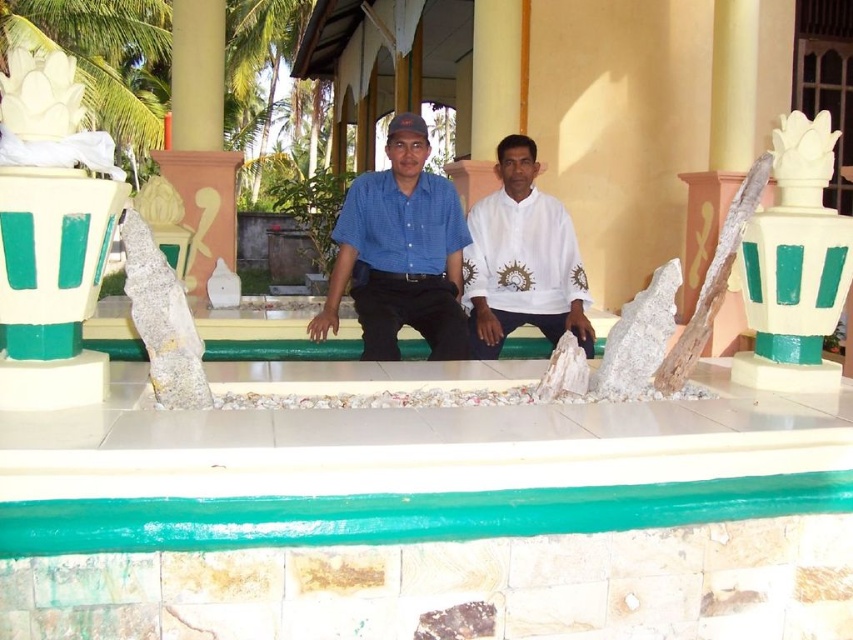
Is blue cotton shirt at center wider than white marble rock at center?

Correct, the width of blue cotton shirt at center exceeds that of white marble rock at center.

Who is higher up, blue cotton shirt at center or white marble rock at center?

Positioned higher is blue cotton shirt at center.

What do you see at coordinates (399, 252) in the screenshot? I see `blue cotton shirt at center` at bounding box center [399, 252].

You are a GUI agent. You are given a task and a screenshot of the screen. Output one action in this format:
    pyautogui.click(x=<x>, y=<y>)
    Task: Click on the blue cotton shirt at center
    
    Given the screenshot: What is the action you would take?
    pyautogui.click(x=399, y=252)

Who is shorter, white matte shirt at center or white marble rock at center?

white marble rock at center is shorter.

Looking at this image, can you confirm if white matte shirt at center is positioned to the left of white marble rock at center?

In fact, white matte shirt at center is to the right of white marble rock at center.

Is point (531, 264) positioned in front of point (132, 280)?

That is False.

Identify the location of white matte shirt at center. This screenshot has width=853, height=640. (521, 259).

Does white stone pillar at right appear under green painted stone ledge at center?

No, white stone pillar at right is not below green painted stone ledge at center.

Can you confirm if white stone pillar at right is positioned to the right of green painted stone ledge at center?

Yes, white stone pillar at right is to the right of green painted stone ledge at center.

Identify the location of white stone pillar at right. click(735, 116).

You are a GUI agent. You are given a task and a screenshot of the screen. Output one action in this format:
    pyautogui.click(x=<x>, y=<y>)
    Task: Click on the white stone pillar at right
    
    Given the screenshot: What is the action you would take?
    [x=735, y=116]